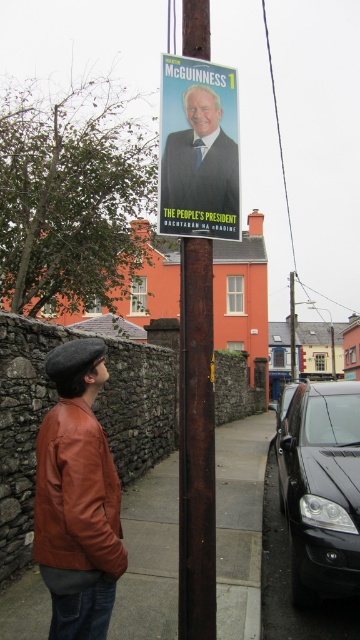
Question: Which of the following is the farthest from the observer?

Choices:
 (A) (132, 513)
 (B) (68, 467)
 (C) (272, 403)

Answer: (C)

Question: Where is smooth concrete pavement at center located in relation to black glossy car at right in the image?

Choices:
 (A) right
 (B) left

Answer: (B)

Question: Can you confirm if matte black poster at upper center is smaller than brown leather jacket at lower left?

Choices:
 (A) yes
 (B) no

Answer: (B)

Question: Which point is closer to the camera?

Choices:
 (A) matte black poster at upper center
 (B) shiny black car at center

Answer: (A)

Question: Which of the following is the farthest from the observer?

Choices:
 (A) (168, 214)
 (B) (357, 509)
 (C) (91, 525)
 (D) (28, 589)

Answer: (D)

Question: Where is black glossy car at right located in relation to brown leather jacket at lower left in the image?

Choices:
 (A) below
 (B) above

Answer: (A)